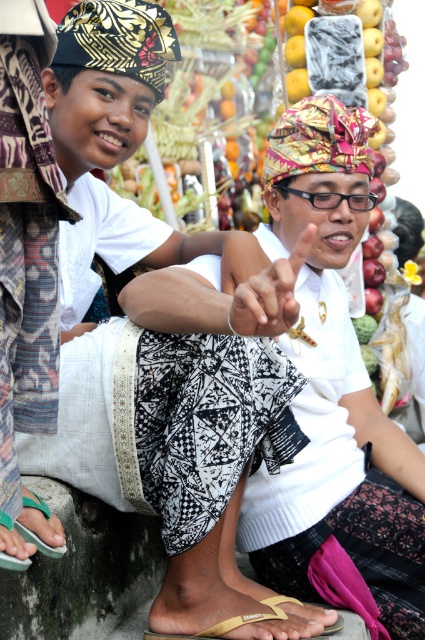
Question: Which object is the farthest from the green flip-flop at lower left?

Choices:
 (A) gold textured sandal at lower center
 (B) yellow fabric sandal at lower center

Answer: (A)

Question: Estimate the real-world distances between objects in this image. Which object is farther from the yellow fabric sandal at lower center?

Choices:
 (A) green flip-flop at lower left
 (B) gold textured sandal at lower center

Answer: (A)

Question: Does green flip-flop at lower left lie behind yellow fabric sandal at lower center?

Choices:
 (A) no
 (B) yes

Answer: (A)

Question: Which object is closer to the camera taking this photo?

Choices:
 (A) yellow fabric sandal at lower center
 (B) gold textured sandal at lower center
 (C) green flip-flop at lower left

Answer: (C)

Question: Does green flip-flop at lower left lie behind yellow fabric sandal at lower center?

Choices:
 (A) yes
 (B) no

Answer: (B)

Question: From the image, what is the correct spatial relationship of yellow fabric sandal at lower center in relation to gold textured sandal at lower center?

Choices:
 (A) left
 (B) right

Answer: (A)